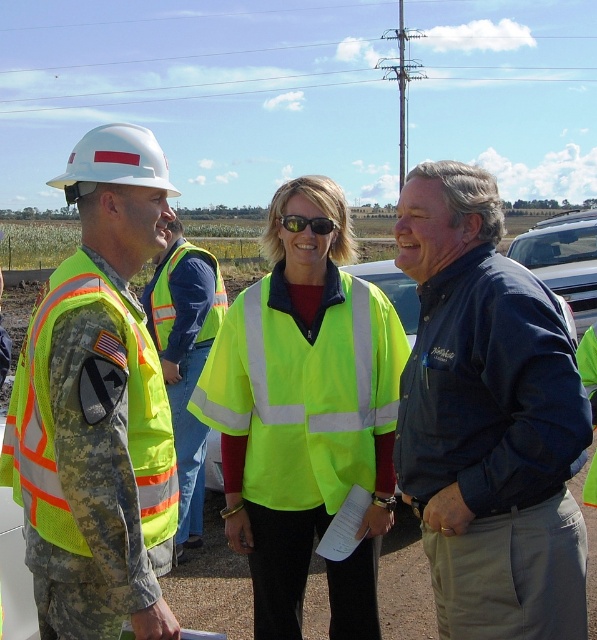
Question: Does neon yellow reflective vest at center appear under neon yellow reflective safety vest at center?

Choices:
 (A) no
 (B) yes

Answer: (B)

Question: From the image, what is the correct spatial relationship of high-visibility reflective vest at left in relation to neon yellow reflective safety vest at center?

Choices:
 (A) left
 (B) right

Answer: (B)

Question: Does high-visibility reflective vest at left have a greater width compared to neon yellow reflective safety vest at center?

Choices:
 (A) yes
 (B) no

Answer: (B)

Question: Among these objects, which one is nearest to the camera?

Choices:
 (A) high-visibility reflective vest at center
 (B) white hard hat at upper left
 (C) neon yellow reflective safety vest at center

Answer: (B)

Question: Which of the following is the farthest from the observer?

Choices:
 (A) blue denim jacket at center
 (B) high-visibility reflective vest at center

Answer: (B)

Question: Which object is the closest to the blue denim jacket at center?

Choices:
 (A) high-visibility reflective vest at left
 (B) high-visibility reflective vest at center

Answer: (A)